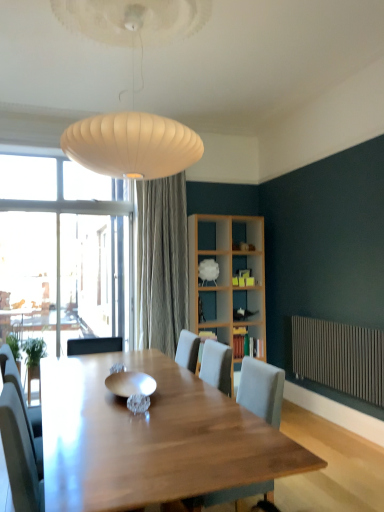
Question: Is shiny metallic bowl at center in front of or behind light gray fabric chair at center in the image?

Choices:
 (A) front
 (B) behind

Answer: (B)

Question: In terms of width, does shiny metallic bowl at center look wider or thinner when compared to light gray fabric chair at center?

Choices:
 (A) thin
 (B) wide

Answer: (A)

Question: Estimate the real-world distances between objects in this image. Which object is closer to the white fabric at upper center, the third shelf in the bottom-to-top sequence?

Choices:
 (A) metallic radiator at lower right
 (B) wooden bookshelf at center, placed as the 2th shelf when sorted from top to bottom
 (C) light gray fabric chair at center
 (D) shiny metallic bowl at center
 (E) wooden bookshelf at center, marked as the 3th shelf in a top-to-bottom arrangement

Answer: (B)

Question: Estimate the real-world distances between objects in this image. Which object is farther from the wooden bookshelf at center, placed as the 2th shelf when sorted from top to bottom?

Choices:
 (A) light gray fabric chair at center
 (B) wooden bookshelf at center, positioned as the 1th shelf in bottom-to-top order
 (C) white fabric at upper center, the third shelf in the bottom-to-top sequence
 (D) shiny metallic bowl at center
 (E) metallic radiator at lower right

Answer: (A)